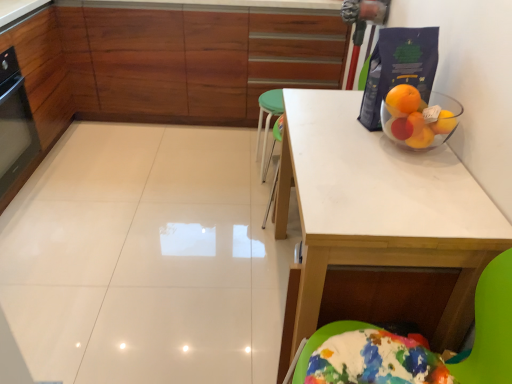
The width and height of the screenshot is (512, 384). I want to click on free point above white matte table at upper right (from a real-world perspective), so click(x=388, y=174).